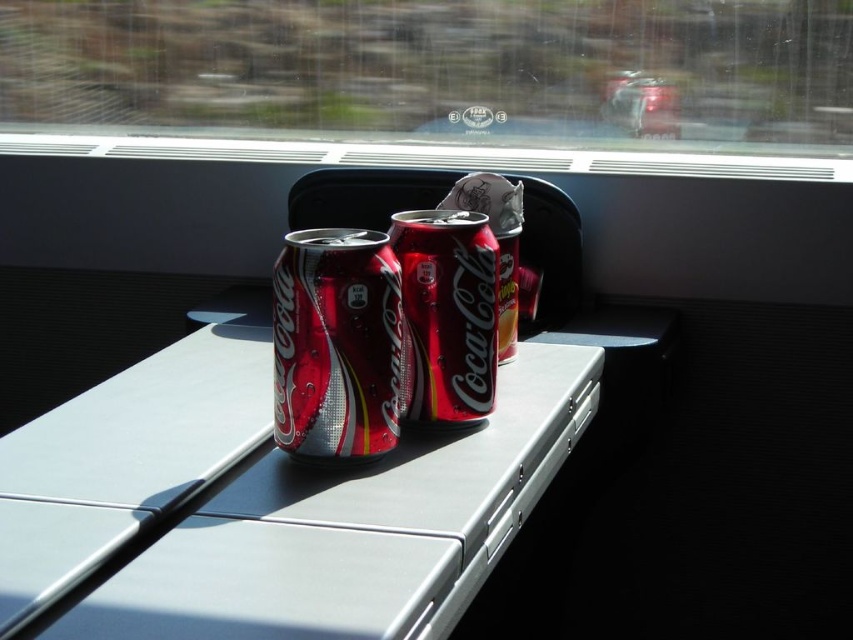
You are a passenger sitting at the table with the Coca Cola cans. You want to place a small notebook on the transparent glass train window at center or the metallic silver window sill at center. Which surface has enough vertical space to place the notebook without it hanging off the edge?

The transparent glass train window at center has a greater height compared to the metallic silver window sill at center, so placing the notebook on the transparent glass train window at center would provide more vertical space and prevent it from hanging off the edge.

From the picture: You are a photographer holding a camera. You want to take a photo of the metallic gray table at center from a distance that ensures the entire table fits in the frame. If your camera has a maximum focus range of 20 inches, will you need to move closer or farther away?

The metallic gray table at center and camera are 22.76 inches apart from each other. Since the camera has a maximum focus range of 20 inches, you need to move closer to ensure the entire table fits in the frame.